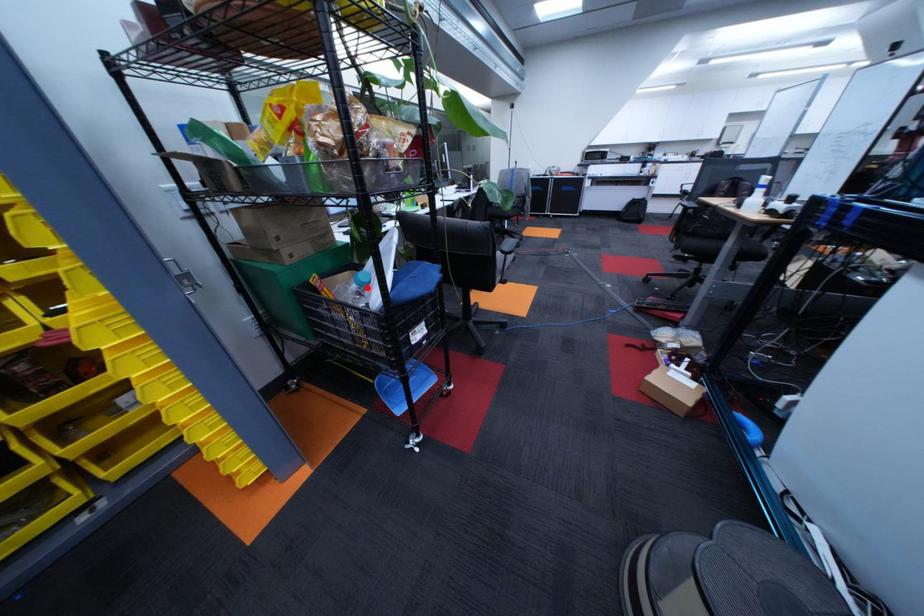
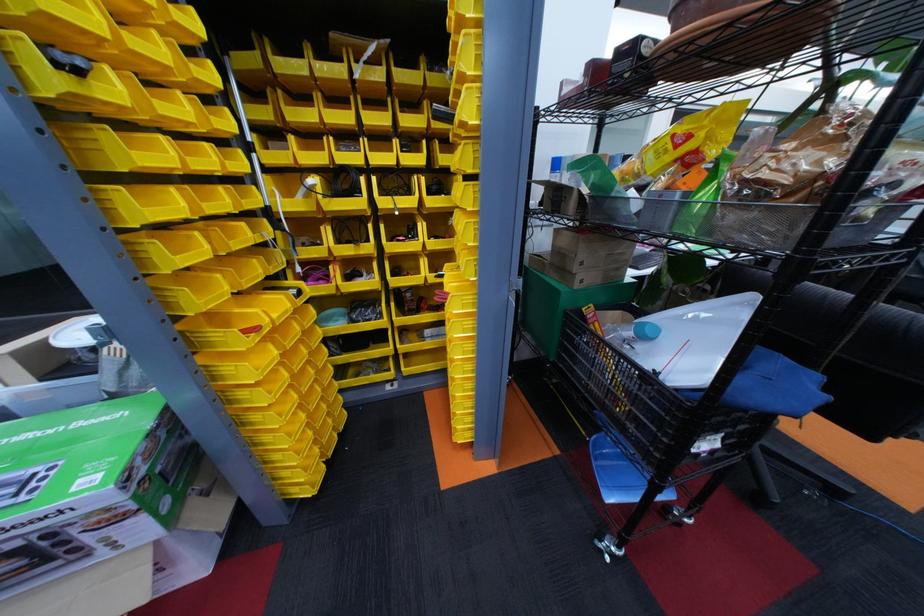
Question: I am providing you with two images of the same scene from different viewpoints. Image1 has a red point marked. In image2, the corresponding 3D location appears at what relative position? Reply with the corresponding letter.

Choices:
 (A) Closer
 (B) Farther

Answer: (A)